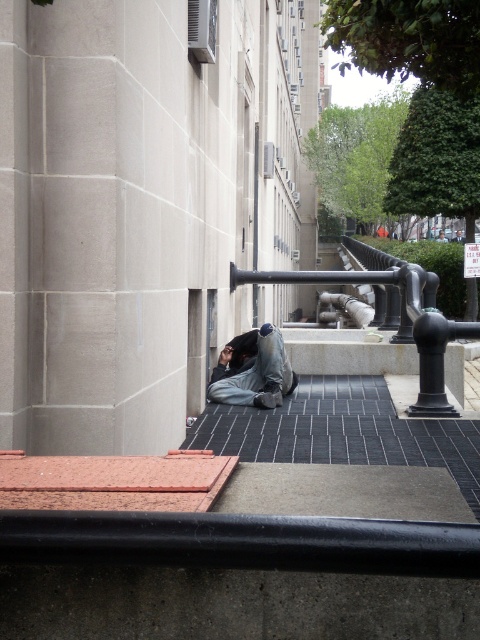
Question: From the image, what is the correct spatial relationship of black metal rail at center in relation to denim pants at lower center?

Choices:
 (A) right
 (B) left

Answer: (A)

Question: Is the position of black metal rail at center less distant than that of denim pants at lower center?

Choices:
 (A) yes
 (B) no

Answer: (A)

Question: Can you confirm if black metal rail at center is bigger than denim pants at lower center?

Choices:
 (A) yes
 (B) no

Answer: (A)